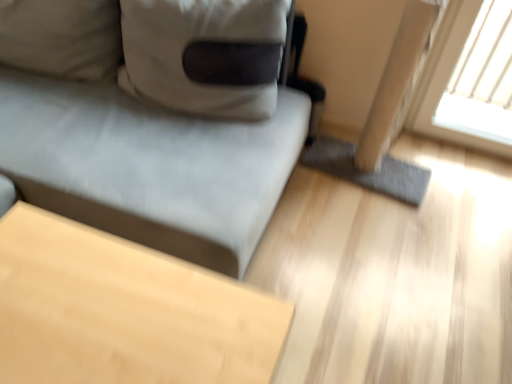
You are a GUI agent. You are given a task and a screenshot of the screen. Output one action in this format:
    pyautogui.click(x=<x>, y=<y>)
    Task: Click on the suede-like gray couch at upper left
    Image resolution: width=512 pixels, height=384 pixels.
    Given the screenshot: What is the action you would take?
    pyautogui.click(x=169, y=130)

The image size is (512, 384). What do you see at coordinates (169, 130) in the screenshot?
I see `suede-like gray couch at upper left` at bounding box center [169, 130].

This screenshot has width=512, height=384. What do you see at coordinates (123, 311) in the screenshot?
I see `light wood table at lower left` at bounding box center [123, 311].

Identify the location of light wood table at lower left. This screenshot has height=384, width=512. (123, 311).

Where is `suede-like gray couch at upper left`? The image size is (512, 384). suede-like gray couch at upper left is located at coordinates (169, 130).

Between suede-like gray couch at upper left and light wood table at lower left, which one appears on the left side from the viewer's perspective?

From the viewer's perspective, suede-like gray couch at upper left appears more on the left side.

Does suede-like gray couch at upper left come behind light wood table at lower left?

Yes, it is.

Is point (207, 11) behind point (99, 340)?

That is True.

From the image's perspective, is suede-like gray couch at upper left located above or below light wood table at lower left?

Clearly, from the image's perspective, suede-like gray couch at upper left is above light wood table at lower left.

From a real-world perspective, is suede-like gray couch at upper left physically above light wood table at lower left?

Yes, from a real-world perspective, suede-like gray couch at upper left is on top of light wood table at lower left.

In terms of width, does suede-like gray couch at upper left look wider or thinner when compared to light wood table at lower left?

In the image, suede-like gray couch at upper left appears to be wider than light wood table at lower left.

In the scene shown: Is suede-like gray couch at upper left shorter than light wood table at lower left?

Incorrect, the height of suede-like gray couch at upper left does not fall short of that of light wood table at lower left.

Is suede-like gray couch at upper left bigger or smaller than light wood table at lower left?

suede-like gray couch at upper left is bigger than light wood table at lower left.

Is suede-like gray couch at upper left completely or partially outside of light wood table at lower left?

Yes, suede-like gray couch at upper left is not within light wood table at lower left.

Would you consider suede-like gray couch at upper left to be distant from light wood table at lower left?

suede-like gray couch at upper left is actually quite close to light wood table at lower left.

Is suede-like gray couch at upper left oriented away from light wood table at lower left?

No, suede-like gray couch at upper left's orientation is not away from light wood table at lower left.

How different are the orientations of suede-like gray couch at upper left and light wood table at lower left in degrees?

89.5 degrees separate the facing orientations of suede-like gray couch at upper left and light wood table at lower left.

How distant is suede-like gray couch at upper left from light wood table at lower left?

A distance of 15.25 inches exists between suede-like gray couch at upper left and light wood table at lower left.

Identify the location of table below the suede-like gray couch at upper left (from the image's perspective). Image resolution: width=512 pixels, height=384 pixels. (123, 311).

Does light wood table at lower left appear on the left side of suede-like gray couch at upper left?

No, light wood table at lower left is not to the left of suede-like gray couch at upper left.

Between light wood table at lower left and suede-like gray couch at upper left, which one is positioned in front?

Positioned in front is light wood table at lower left.

Is point (28, 306) behind point (309, 122)?

No, (28, 306) is closer to viewer.

From the image's perspective, is light wood table at lower left on suede-like gray couch at upper left?

No, from the image's perspective, light wood table at lower left is not on top of suede-like gray couch at upper left.

From a real-world perspective, is light wood table at lower left positioned above or below suede-like gray couch at upper left?

In terms of real-world spatial position, light wood table at lower left is below suede-like gray couch at upper left.

Is light wood table at lower left wider or thinner than suede-like gray couch at upper left?

Clearly, light wood table at lower left has less width compared to suede-like gray couch at upper left.

Is light wood table at lower left shorter than suede-like gray couch at upper left?

Correct, light wood table at lower left is not as tall as suede-like gray couch at upper left.

Does light wood table at lower left have a larger size compared to suede-like gray couch at upper left?

Actually, light wood table at lower left might be smaller than suede-like gray couch at upper left.

Could suede-like gray couch at upper left be considered to be inside light wood table at lower left?

No, suede-like gray couch at upper left is not a part of light wood table at lower left.

Would you consider light wood table at lower left to be distant from suede-like gray couch at upper left?

No, light wood table at lower left is in close proximity to suede-like gray couch at upper left.

Is light wood table at lower left turned away from suede-like gray couch at upper left?

No, light wood table at lower left is not facing the opposite direction of suede-like gray couch at upper left.

What's the angular difference between light wood table at lower left and suede-like gray couch at upper left's facing directions?

light wood table at lower left and suede-like gray couch at upper left are facing 89.5 degrees away from each other.

This screenshot has height=384, width=512. What are the coordinates of `table located below the suede-like gray couch at upper left (from the image's perspective)` in the screenshot? It's located at [x=123, y=311].

This screenshot has height=384, width=512. Find the location of `studio couch above the light wood table at lower left (from the image's perspective)`. studio couch above the light wood table at lower left (from the image's perspective) is located at coordinates (169, 130).

You are a GUI agent. You are given a task and a screenshot of the screen. Output one action in this format:
    pyautogui.click(x=<x>, y=<y>)
    Task: Click on the table in front of the suede-like gray couch at upper left
    This screenshot has width=512, height=384.
    Given the screenshot: What is the action you would take?
    pyautogui.click(x=123, y=311)